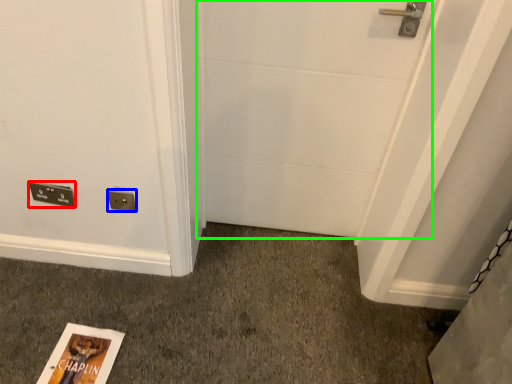
Question: Which is nearer to the light switch (highlighted by a red box)? electric outlet (highlighted by a blue box) or door (highlighted by a green box).

Choices:
 (A) electric outlet
 (B) door

Answer: (A)